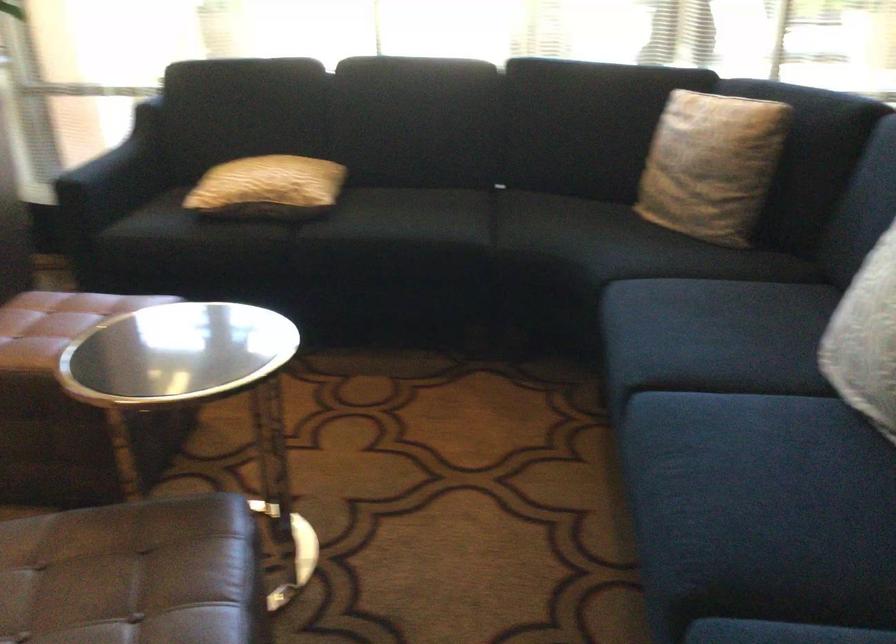
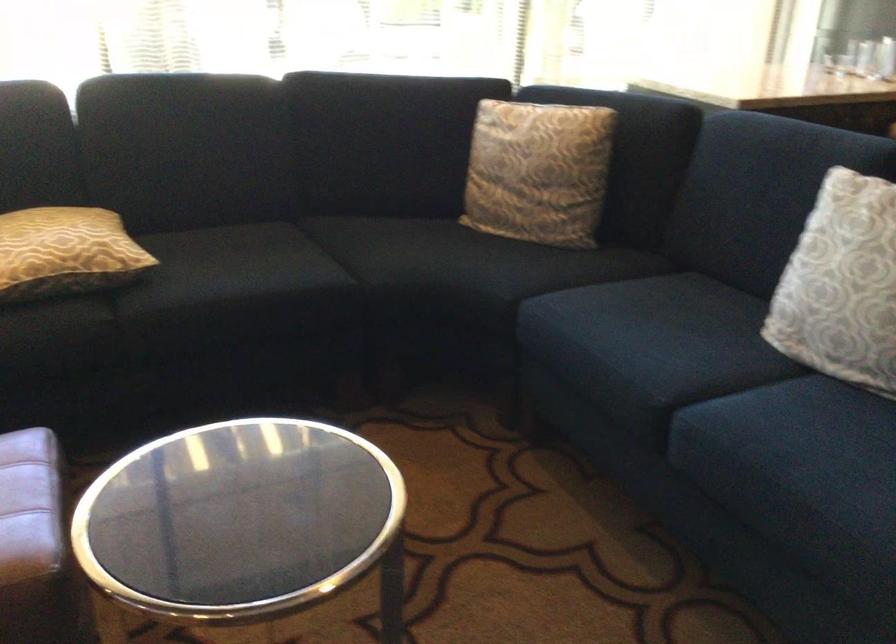
The point at (533, 230) is marked in the first image. Where is the corresponding point in the second image?

(391, 261)